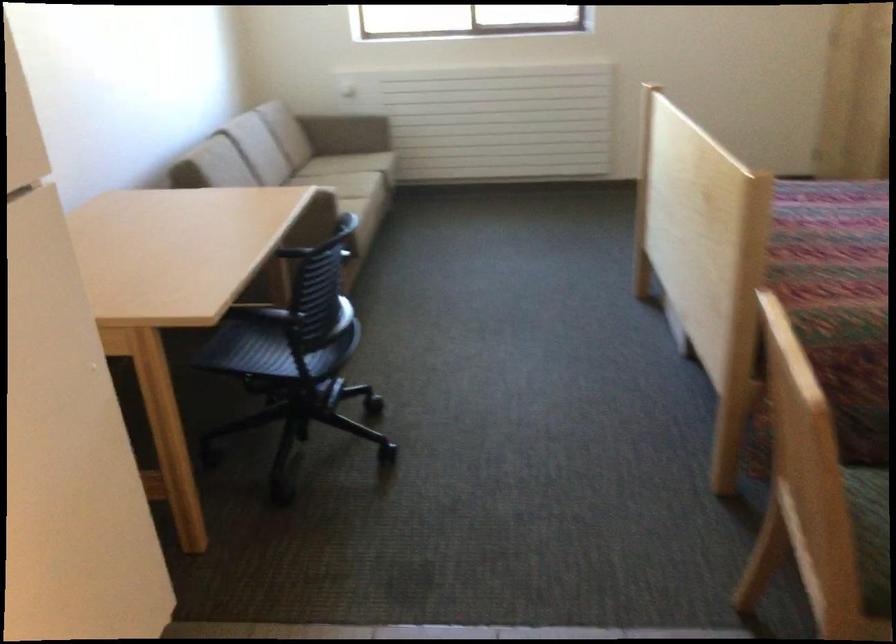
Where would you sit the sofa sitting surface? Please return your answer as a coordinate pair (x, y).

(337, 146)